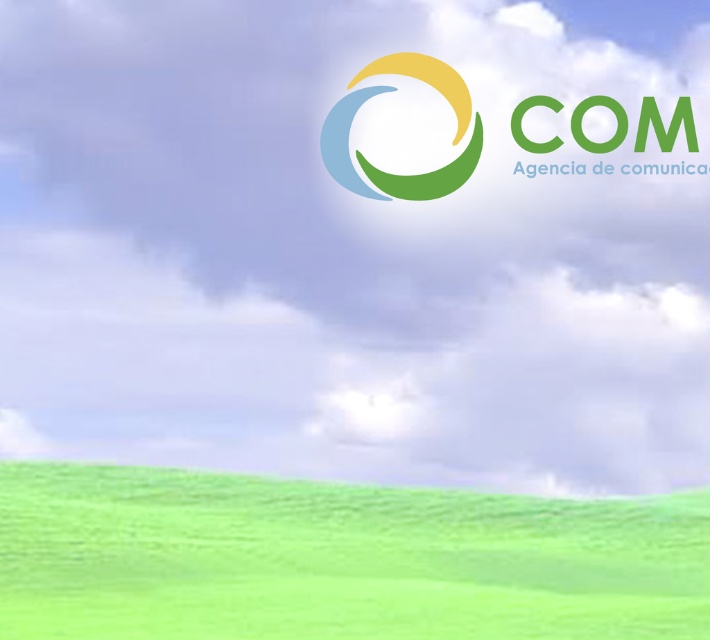
Does green grassy field at lower center have a larger size compared to matte plastic logo at center?

Indeed, green grassy field at lower center has a larger size compared to matte plastic logo at center.

Is green grassy field at lower center positioned behind matte plastic logo at center?

No, green grassy field at lower center is closer to the viewer.

Which is in front, point (568, 628) or point (413, 60)?

Point (568, 628) is in front.

Locate an element on the screen. The width and height of the screenshot is (710, 640). green grassy field at lower center is located at coordinates (337, 560).